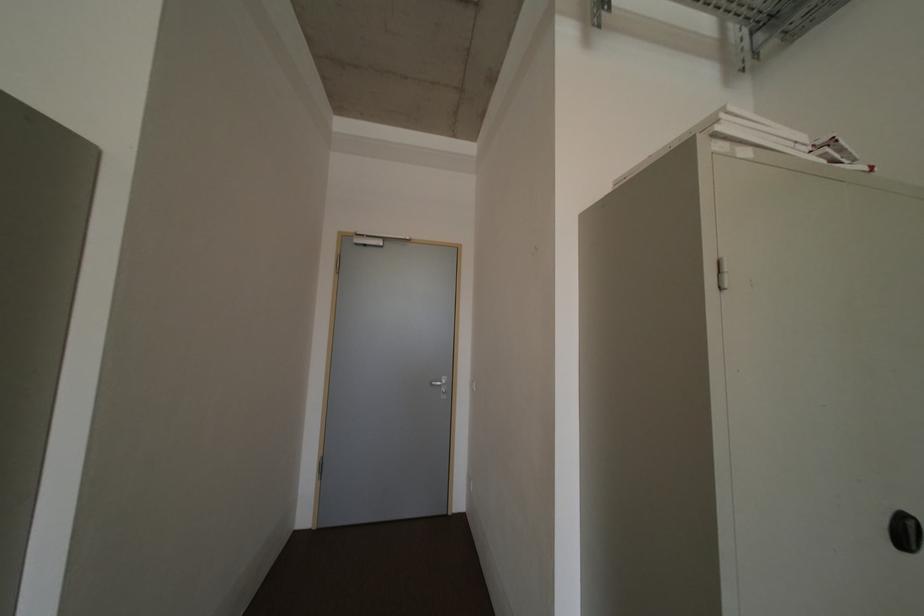
The image size is (924, 616). Describe the element at coordinates (440, 385) in the screenshot. I see `a silver door handle` at that location.